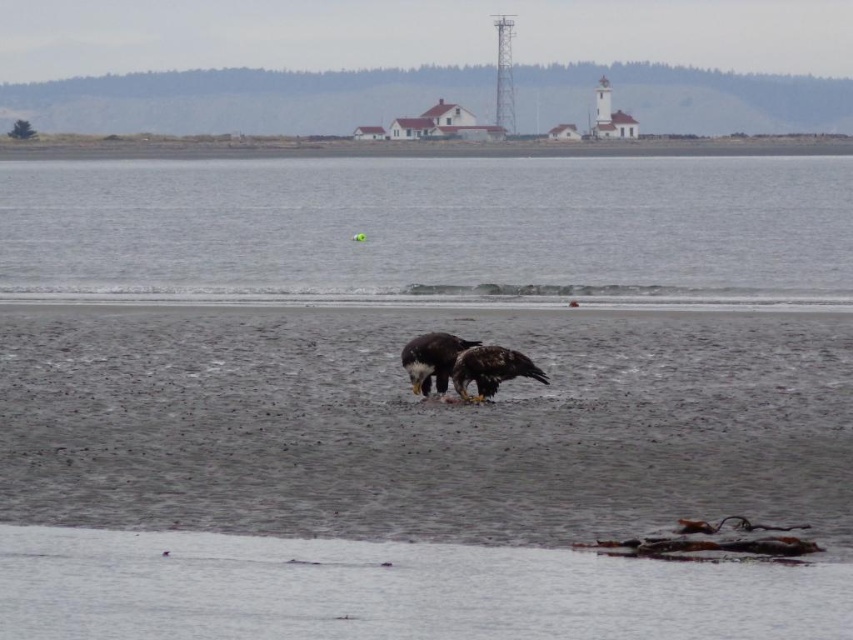
You are a wildlife photographer aiming to capture a closeup shot of the brown feathered eagle at center. Your camera has a maximum focus range of 100 feet. Can you take the photo from your current position near the gray matte water at center?

The distance between the gray matte water at center and the brown feathered eagle at center is 98.13 feet, which is within the camera maximum focus range of 100 feet. Yes, you can take the photo from your current position near the gray matte water at center.

You are a birdwatcher observing the scene from the shore. You notice the white feathers eagle at center and the gray matte water at center. Which object is closer to your viewpoint?

The gray matte water at center is closer to your viewpoint because the white feathers eagle at center is positioned behind it.

You are a wildlife photographer aiming to capture a closeup shot of the brown feathered eagle at center. Based on its 2D position in the image, which part of the frame should you focus on to ensure the eagle is centered in your shot?

To center the brown feathered eagle at center in your shot, focus on the point at coordinates approximately 0.578 on the x axis and 0.576 on the y axis, as this is where the eagle is located in the 2D image plane.